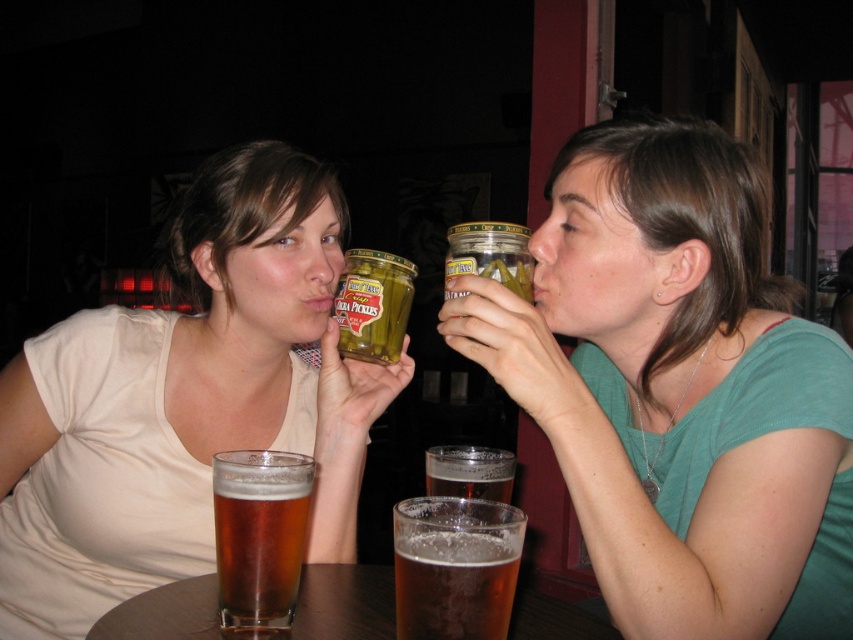
You are a bartender who needs to place the green matte jar at upper center on the translucent glass table at center. Will the jar fit on the table?

The green matte jar at upper center is bigger than the translucent glass table at center, so placing it might not be possible due to size mismatch.

You are a waiter at the bar. You need to place a new drink order between the matte white tank top at upper left and the brown translucent glass at center. Can you fit it there?

The matte white tank top at upper left might be wider than brown translucent glass at center, so there may not be enough space to fit the new drink order between them.

You are a bartender who needs to place a new drink order. The customer has a matte white tank top at upper left and a brown translucent glass at center on their table. Which object should you prioritize replacing first if the customer needs more drinks?

The brown translucent glass at center should be prioritized for replacement since the matte white tank top at upper left is much taller than the brown translucent glass at center, meaning the glass is shorter and likely empty.